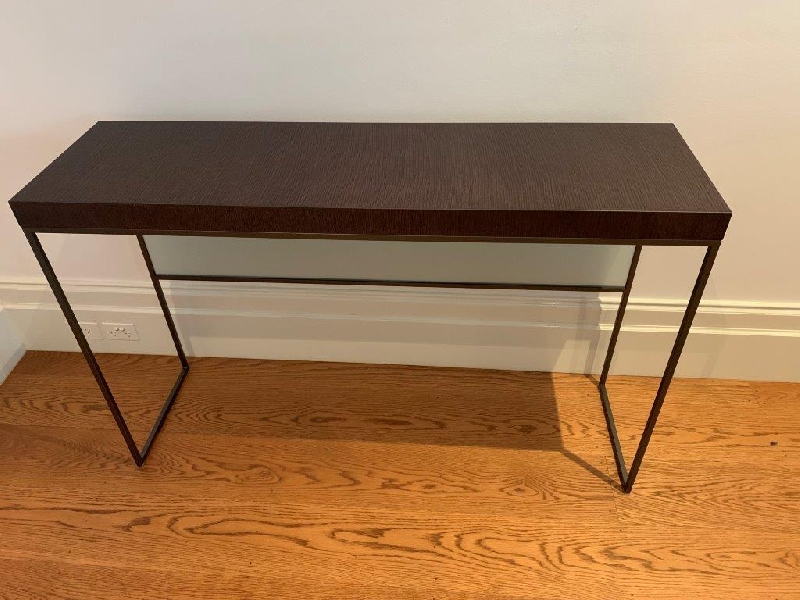
What are the coordinates of `sharper part of desk edges` in the screenshot? It's located at (53, 161).